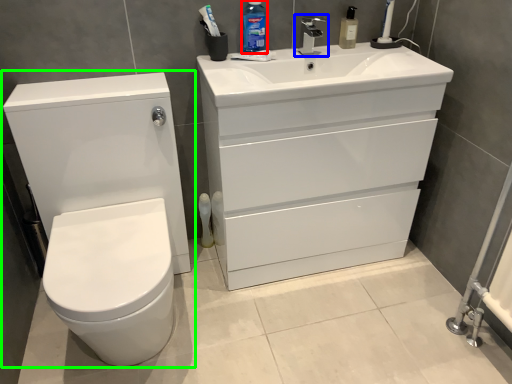
Question: Considering the real-world distances, which object is closest to cleaning product (highlighted by a red box)? tap (highlighted by a blue box) or toilet (highlighted by a green box).

Choices:
 (A) tap
 (B) toilet

Answer: (A)